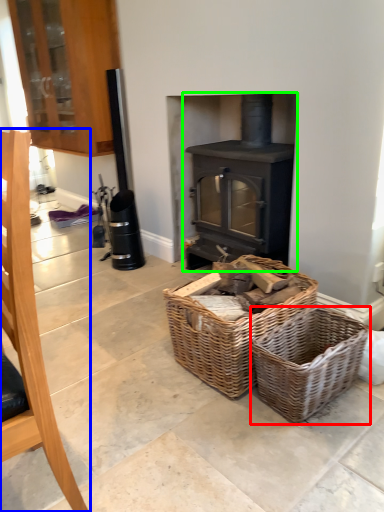
Question: Estimate the real-world distances between objects in this image. Which object is farther from basket (highlighted by a red box), furniture (highlighted by a blue box) or wood burning stove (highlighted by a green box)?

Choices:
 (A) furniture
 (B) wood burning stove

Answer: (A)